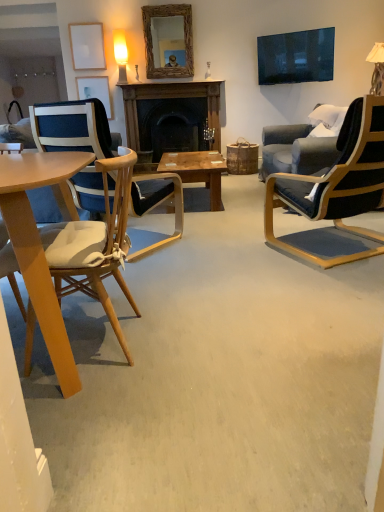
You are a GUI agent. You are given a task and a screenshot of the screen. Output one action in this format:
    pyautogui.click(x=<x>, y=<y>)
    Task: Click on the vacant area that lies in front of light brown wood chair at left, which appears as the 2th chair when viewed from the left
    The height and width of the screenshot is (512, 384).
    Given the screenshot: What is the action you would take?
    pyautogui.click(x=102, y=411)